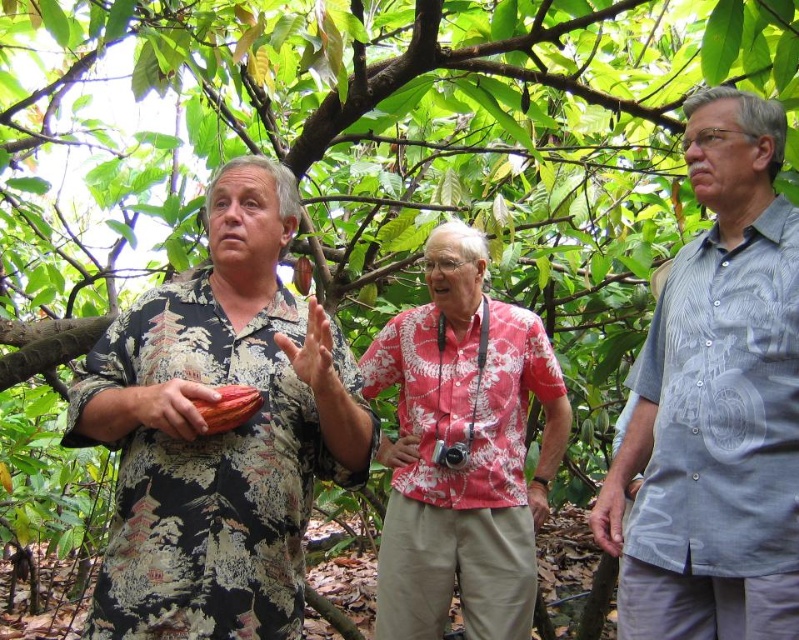
In the scene, there are two people wearing the light blue printed shirt at right and the red floral shirt at center. Which one is positioned more towards the east if the sun is setting in the west?

The light blue printed shirt at right is to the right of the red floral shirt at center, so if the sun is setting in the west, the light blue printed shirt at right would be positioned more towards the east since it is on the right side facing the direction of the setting sun.

You are a photographer trying to capture a group photo of the three individuals under the tree. You notice two shirts at the center of the image, one brown floral shirt at center and a red floral shirt at center. Which shirt should you focus on to ensure it appears larger in the photo?

The red floral shirt at center is larger in size compared to the brown floral shirt at center, so focusing on the red floral shirt at center will make it appear larger in the photo.

You are a photographer trying to frame a group photo of the two people in the scene. The brown floral shirt at center and the light blue printed shirt at right are standing side by side. Which person should you position closer to the camera to ensure both appear equally tall in the photo?

You should position the brown floral shirt at center closer to the camera because the brown floral shirt at center is not as tall as light blue printed shirt at right, so moving them closer will make them appear taller in the photo.